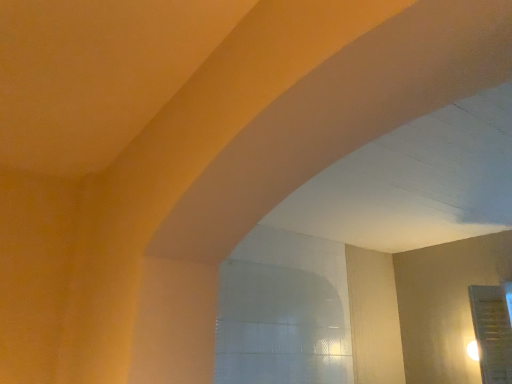
Question: Could you tell me if transparent glass door at lower right is turned towards clear glass window at center?

Choices:
 (A) no
 (B) yes

Answer: (B)

Question: Is clear glass window at center at the back of transparent glass door at lower right?

Choices:
 (A) yes
 (B) no

Answer: (B)

Question: Is transparent glass door at lower right to the right of clear glass window at center from the viewer's perspective?

Choices:
 (A) yes
 (B) no

Answer: (A)

Question: Is transparent glass door at lower right not close to clear glass window at center?

Choices:
 (A) no
 (B) yes

Answer: (B)

Question: From a real-world perspective, does transparent glass door at lower right stand above clear glass window at center?

Choices:
 (A) yes
 (B) no

Answer: (A)

Question: Is clear glass window at center located within transparent glass door at lower right?

Choices:
 (A) yes
 (B) no

Answer: (B)

Question: Can you confirm if clear glass window at center is taller than transparent glass door at lower right?

Choices:
 (A) no
 (B) yes

Answer: (A)

Question: Is clear glass window at center next to transparent glass door at lower right and touching it?

Choices:
 (A) yes
 (B) no

Answer: (B)

Question: Does clear glass window at center appear on the right side of transparent glass door at lower right?

Choices:
 (A) no
 (B) yes

Answer: (A)

Question: From the image's perspective, is clear glass window at center below transparent glass door at lower right?

Choices:
 (A) no
 (B) yes

Answer: (A)

Question: Can we say clear glass window at center lies outside transparent glass door at lower right?

Choices:
 (A) yes
 (B) no

Answer: (A)

Question: Does clear glass window at center have a larger size compared to transparent glass door at lower right?

Choices:
 (A) yes
 (B) no

Answer: (B)

Question: Considering their positions, is clear glass window at center located in front of or behind transparent glass door at lower right?

Choices:
 (A) front
 (B) behind

Answer: (A)